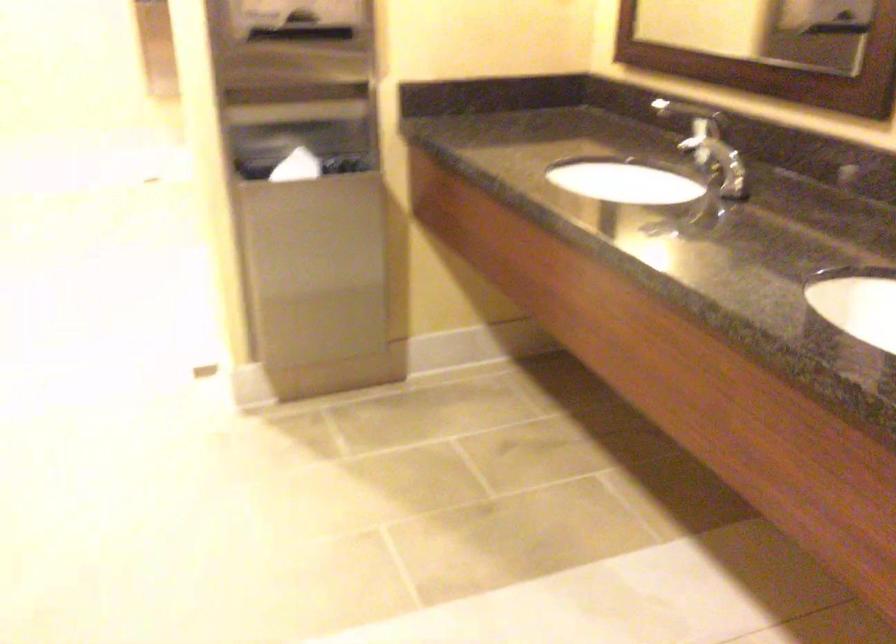
In order to click on towel dispenser slot in this screenshot , I will do `click(816, 33)`.